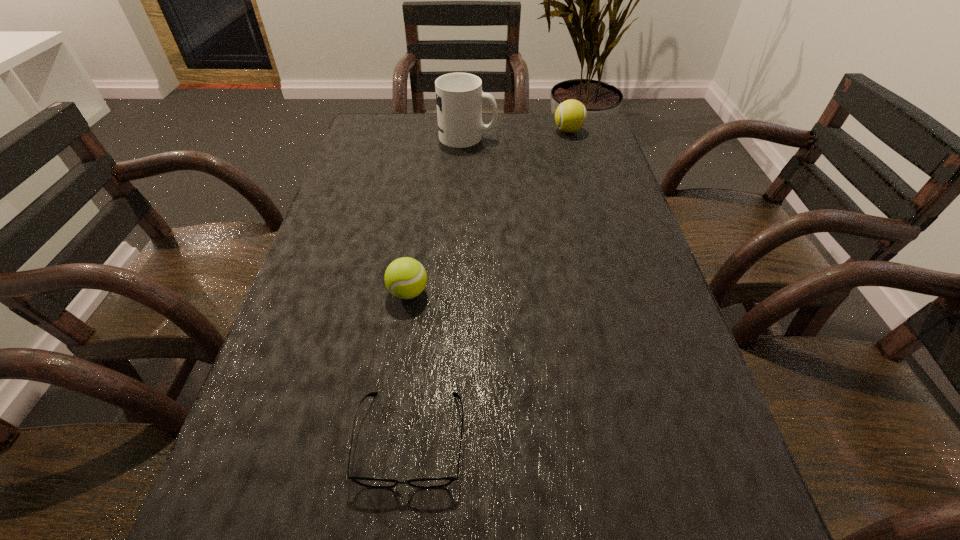
Point out which object is positioned as the second nearest to the farther tennis ball. Please provide its 2D coordinates. Your answer should be formatted as a tuple, i.e. [(x, y)], where the tuple contains the x and y coordinates of a point satisfying the conditions above.

[(405, 278)]

You are a GUI agent. You are given a task and a screenshot of the screen. Output one action in this format:
    pyautogui.click(x=<x>, y=<y>)
    Task: Click on the vacant area that satisfies the following two spatial constraints: 1. on the handle side of the tallest object; 2. on the front-facing side of the nearest object
    The width and height of the screenshot is (960, 540).
    Given the screenshot: What is the action you would take?
    pyautogui.click(x=456, y=438)